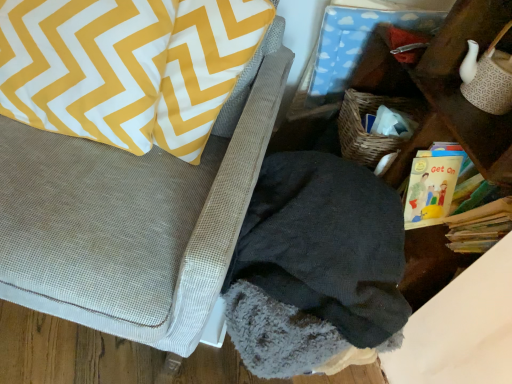
This screenshot has width=512, height=384. Find the location of `fuzzy gray blanket at lower right`. fuzzy gray blanket at lower right is located at coordinates (133, 219).

At what (x,y) coordinates should I click in order to perform the action: click on fuzzy gray blanket at lower right. Please return your answer as a coordinate pair (x, y). Image resolution: width=512 pixels, height=384 pixels. Looking at the image, I should click on point(133,219).

From a real-world perspective, does yellow paper book at right stand above dark fleece blanket at lower right?

Yes, from a real-world perspective, yellow paper book at right is on top of dark fleece blanket at lower right.

From the image's perspective, would you say yellow paper book at right is shown under dark fleece blanket at lower right?

No, from the image's perspective, yellow paper book at right is not beneath dark fleece blanket at lower right.

Considering the points (430, 193) and (343, 202), which point is behind, point (430, 193) or point (343, 202)?

The point (430, 193) is more distant.

In the scene shown: Considering the sizes of objects yellow paper book at right and dark fleece blanket at lower right in the image provided, who is bigger, yellow paper book at right or dark fleece blanket at lower right?

dark fleece blanket at lower right is bigger.

Image resolution: width=512 pixels, height=384 pixels. Identify the location of book lying on the right of fuzzy gray blanket at lower right. (450, 204).

Between yellow paper book at right and fuzzy gray blanket at lower right, which one has smaller size?

With smaller size is yellow paper book at right.

From a real-world perspective, is yellow paper book at right positioned above or below fuzzy gray blanket at lower right?

yellow paper book at right is situated higher than fuzzy gray blanket at lower right in the real world.

From the image's perspective, does yellow paper book at right appear lower than fuzzy gray blanket at lower right?

Yes, from the image's perspective, yellow paper book at right is beneath fuzzy gray blanket at lower right.

Is yellow/white zigzag pillow at upper left positioned far away from dark fleece blanket at lower right?

That's not correct — yellow/white zigzag pillow at upper left is a little close to dark fleece blanket at lower right.

Locate an element on the screen. The image size is (512, 384). pillow above the dark fleece blanket at lower right (from a real-world perspective) is located at coordinates (85, 66).

Which is behind, point (154, 41) or point (303, 246)?

The point (154, 41) is farther.

Is yellow/white zigzag pillow at upper left facing away from dark fleece blanket at lower right?

That's not correct — yellow/white zigzag pillow at upper left is not looking away from dark fleece blanket at lower right.

Is yellow/white zigzag pillow at upper left in contact with fuzzy gray blanket at lower right?

No, yellow/white zigzag pillow at upper left is not in contact with fuzzy gray blanket at lower right.

Is yellow/white zigzag pillow at upper left oriented towards fuzzy gray blanket at lower right?

Yes, yellow/white zigzag pillow at upper left faces towards fuzzy gray blanket at lower right.

Considering the sizes of yellow/white zigzag pillow at upper left and fuzzy gray blanket at lower right in the image, is yellow/white zigzag pillow at upper left taller or shorter than fuzzy gray blanket at lower right?

Clearly, yellow/white zigzag pillow at upper left is shorter compared to fuzzy gray blanket at lower right.

Consider the image. Is yellow/white zigzag pillow at upper left surrounding yellow paper book at right?

No, yellow paper book at right is not a part of yellow/white zigzag pillow at upper left.

From a real-world perspective, is yellow/white zigzag pillow at upper left physically below yellow paper book at right?

No, from a real-world perspective, yellow/white zigzag pillow at upper left is not below yellow paper book at right.

Is yellow/white zigzag pillow at upper left directly adjacent to yellow paper book at right?

There is a gap between yellow/white zigzag pillow at upper left and yellow paper book at right.

Does yellow/white zigzag pillow at upper left appear on the right side of yellow paper book at right?

In fact, yellow/white zigzag pillow at upper left is to the left of yellow paper book at right.

What's the angular difference between yellow paper book at right and yellow/white zigzag pillow at upper left's facing directions?

There is a 61.3-degree angle between the facing directions of yellow paper book at right and yellow/white zigzag pillow at upper left.

Considering the positions of objects yellow paper book at right and yellow/white zigzag pillow at upper left in the image provided, who is more to the left, yellow paper book at right or yellow/white zigzag pillow at upper left?

From the viewer's perspective, yellow/white zigzag pillow at upper left appears more on the left side.

Does yellow paper book at right contain yellow/white zigzag pillow at upper left?

That's incorrect, yellow/white zigzag pillow at upper left is not inside yellow paper book at right.

Who is more distant, yellow paper book at right or yellow/white zigzag pillow at upper left?

Positioned behind is yellow paper book at right.

From a real-world perspective, which is physically above, fuzzy gray blanket at lower right or yellow paper book at right?

yellow paper book at right, from a real-world perspective.

Which object is further away from the camera taking this photo, fuzzy gray blanket at lower right or yellow paper book at right?

yellow paper book at right is more distant.

Who is shorter, fuzzy gray blanket at lower right or yellow paper book at right?

yellow paper book at right.

From the image's perspective, is fuzzy gray blanket at lower right above or below yellow paper book at right?

Clearly, from the image's perspective, fuzzy gray blanket at lower right is above yellow paper book at right.

Identify the location of clothing that appears below the yellow paper book at right (from the image's perspective). Image resolution: width=512 pixels, height=384 pixels. (316, 268).

At what (x,y) coordinates should I click in order to perform the action: click on book on the right of fuzzy gray blanket at lower right. Please return your answer as a coordinate pair (x, y). This screenshot has width=512, height=384. Looking at the image, I should click on (450, 204).

In the scene shown: Which object lies further to the anchor point yellow/white zigzag pillow at upper left, yellow paper book at right or fuzzy gray blanket at lower right?

yellow paper book at right is positioned further to the anchor yellow/white zigzag pillow at upper left.

From the image, which object appears to be nearer to dark fleece blanket at lower right, yellow/white zigzag pillow at upper left or yellow paper book at right?

yellow paper book at right.

Looking at the image, which one is located further to yellow/white zigzag pillow at upper left, dark fleece blanket at lower right or fuzzy gray blanket at lower right?

dark fleece blanket at lower right is positioned further to the anchor yellow/white zigzag pillow at upper left.

Which object lies further to the anchor point fuzzy gray blanket at lower right, yellow/white zigzag pillow at upper left or dark fleece blanket at lower right?

dark fleece blanket at lower right.

Considering their positions, is fuzzy gray blanket at lower right positioned closer to yellow/white zigzag pillow at upper left than dark fleece blanket at lower right?

Based on the image, fuzzy gray blanket at lower right appears to be nearer to yellow/white zigzag pillow at upper left.

Considering their positions, is yellow paper book at right positioned further to yellow/white zigzag pillow at upper left than dark fleece blanket at lower right?

The object further to yellow/white zigzag pillow at upper left is yellow paper book at right.

When comparing their distances from yellow/white zigzag pillow at upper left, does dark fleece blanket at lower right or yellow paper book at right seem closer?

dark fleece blanket at lower right is closer to yellow/white zigzag pillow at upper left.

Which object lies nearer to the anchor point yellow paper book at right, dark fleece blanket at lower right or fuzzy gray blanket at lower right?

dark fleece blanket at lower right.

This screenshot has width=512, height=384. I want to click on furniture between yellow/white zigzag pillow at upper left and yellow paper book at right in the horizontal direction, so click(133, 219).

Find the location of a particular element. The height and width of the screenshot is (384, 512). clothing situated between yellow/white zigzag pillow at upper left and yellow paper book at right from left to right is located at coordinates (316, 268).

The width and height of the screenshot is (512, 384). What are the coordinates of `furniture between yellow/white zigzag pillow at upper left and dark fleece blanket at lower right from left to right` in the screenshot? It's located at (133, 219).

Find the location of `clothing situated between fuzzy gray blanket at lower right and yellow paper book at right from left to right`. clothing situated between fuzzy gray blanket at lower right and yellow paper book at right from left to right is located at coordinates (316, 268).